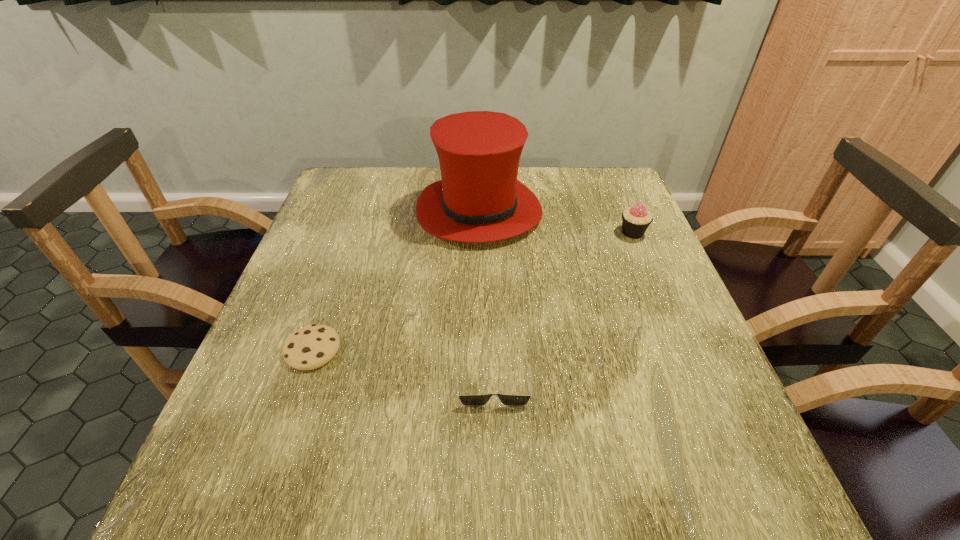
Locate an element on the screen. The width and height of the screenshot is (960, 540). object at the left edge is located at coordinates (310, 347).

Find the location of a particular element. Image resolution: width=960 pixels, height=540 pixels. object located in the right edge section of the desktop is located at coordinates (635, 220).

In the image, there is a desktop. Identify the location of free space at the far edge. (392, 186).

Find the location of a particular element. vacant space at the left edge of the desktop is located at coordinates (341, 293).

Find the location of a particular element. vacant region at the right edge of the desktop is located at coordinates (657, 332).

The image size is (960, 540). In the image, there is a desktop. Find the location of `vacant space at the far left corner`. vacant space at the far left corner is located at coordinates (337, 176).

This screenshot has height=540, width=960. In order to click on vacant space at the near left corner of the desktop in this screenshot , I will do point(256,481).

I want to click on vacant area at the far right corner, so click(617, 186).

Find the location of a particular element. The width and height of the screenshot is (960, 540). vacant area that lies between the cookie and the sunglasses is located at coordinates (403, 364).

I want to click on free point between the rightmost object and the leftmost object, so click(x=472, y=291).